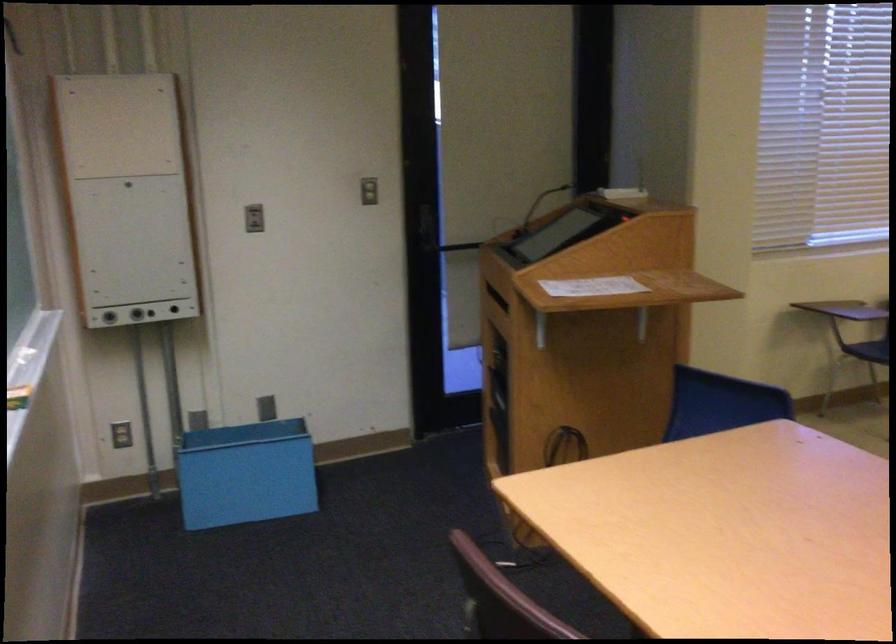
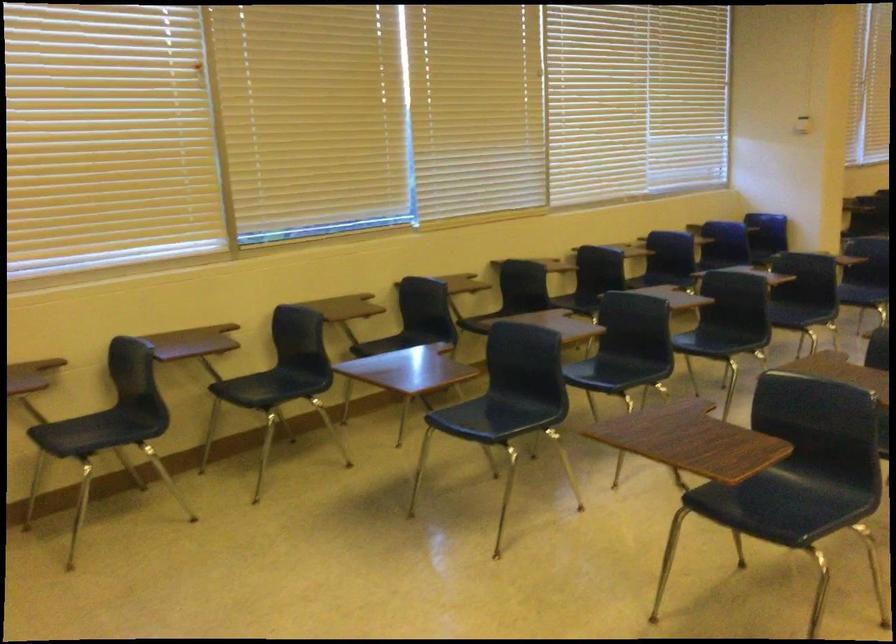
What movement of the cameraman would produce the second image?

The cameraman moved toward right, forward.